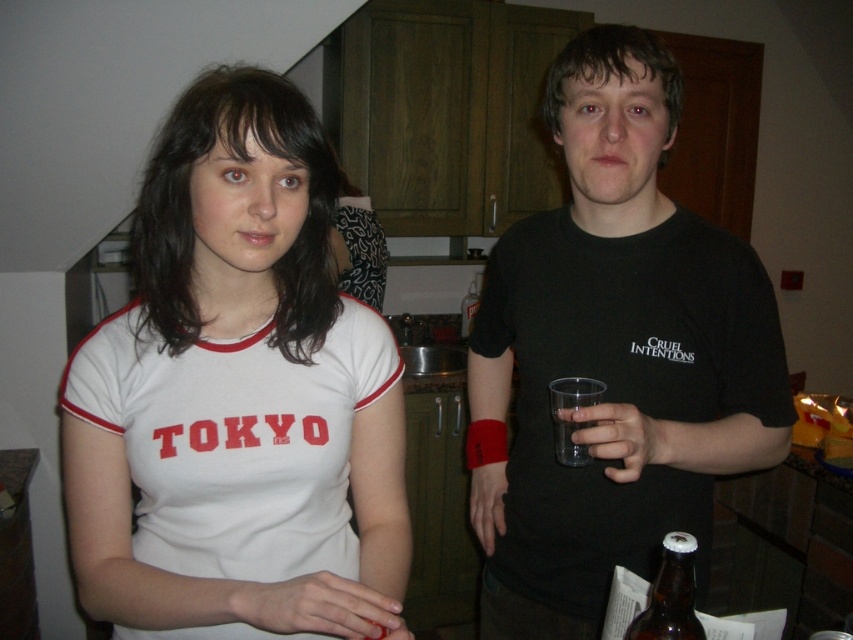
Between brown glass bottle at lower right and clear plastic cup at right, which one has less height?

With less height is brown glass bottle at lower right.

Does point (679, 625) come closer to viewer compared to point (461, 324)?

Yes, it is.

Find the location of `brown glass bottle at lower right`. brown glass bottle at lower right is located at coordinates (670, 595).

Is black matte t-shirt at center bigger than transparent plastic cup at center?

Yes, black matte t-shirt at center is bigger than transparent plastic cup at center.

Is point (733, 344) closer to viewer compared to point (567, 396)?

No, (733, 344) is further to viewer.

Describe the element at coordinates (613, 356) in the screenshot. The height and width of the screenshot is (640, 853). I see `black matte t-shirt at center` at that location.

Locate an element on the screen. The width and height of the screenshot is (853, 640). black matte t-shirt at center is located at coordinates (613, 356).

Which is behind, point (683, 589) or point (561, 417)?

The point (561, 417) is more distant.

Is point (676, 605) positioned behind point (569, 396)?

No.

The image size is (853, 640). In order to click on brown glass bottle at lower right in this screenshot , I will do `click(670, 595)`.